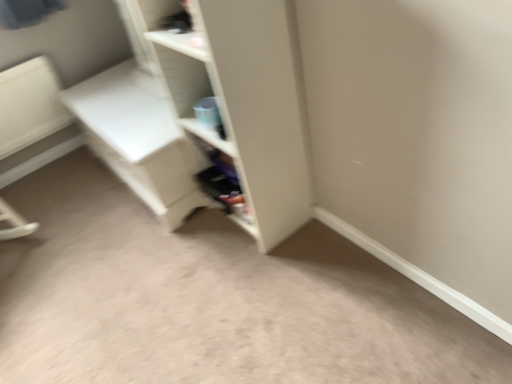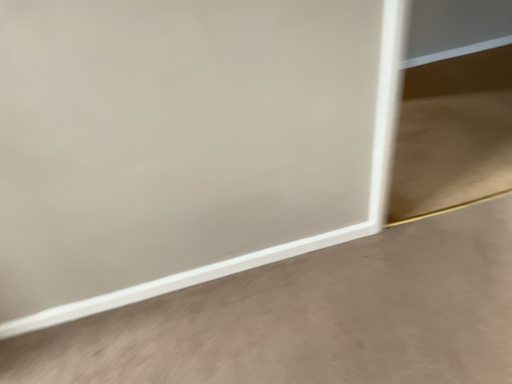
Question: How did the camera likely rotate when shooting the video?

Choices:
 (A) rotated downward
 (B) rotated upward

Answer: (B)